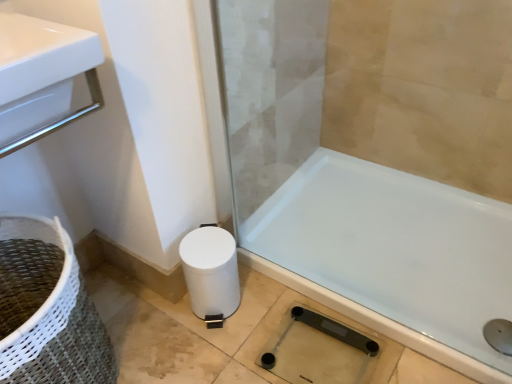
What are the coordinates of `free space that is in between transparent glass shower at lower right and white matte toilet paper at lower left` in the screenshot? It's located at (253, 320).